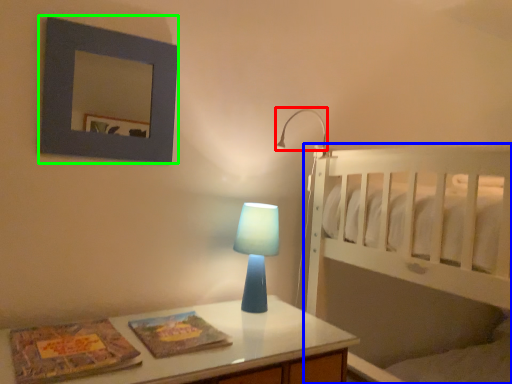
Question: Which object is the closest to the lamp (highlighted by a red box)? Choose among these: bed (highlighted by a blue box) or picture frame (highlighted by a green box).

Choices:
 (A) bed
 (B) picture frame

Answer: (A)